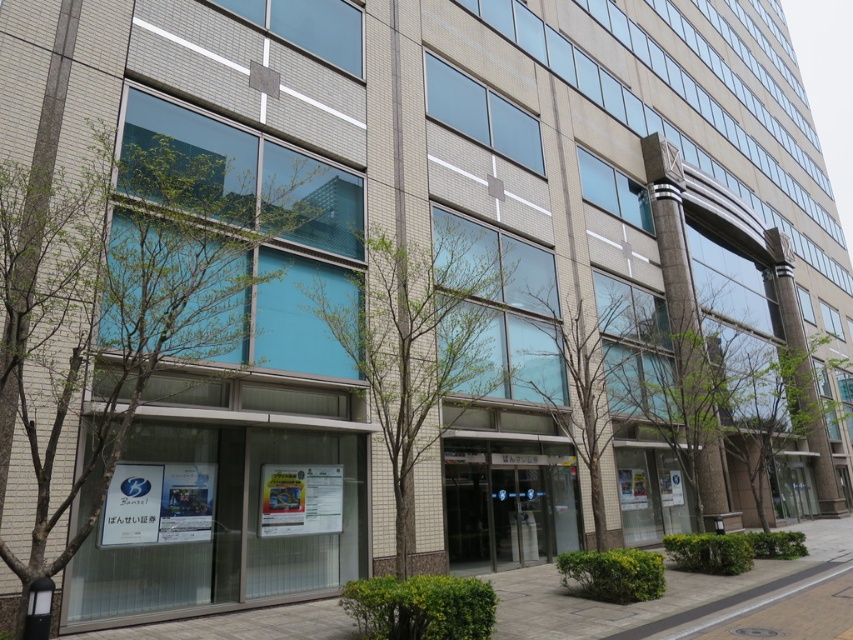
Question: Which point appears farthest from the camera in this image?

Choices:
 (A) (283, 616)
 (B) (38, 301)
 (C) (567, 308)

Answer: (C)

Question: Estimate the real-world distances between objects in this image. Which object is closer to the transparent glass window at center?

Choices:
 (A) smooth concrete pavement at lower center
 (B) bare branches at center

Answer: (A)

Question: From the image, what is the correct spatial relationship of transparent glass window at center in relation to bare branches at center?

Choices:
 (A) left
 (B) right

Answer: (A)

Question: Based on their relative distances, which object is farther from the smooth concrete pavement at lower center?

Choices:
 (A) transparent glass window at center
 (B) bare branches at center

Answer: (A)

Question: Does smooth concrete pavement at lower center appear on the left side of bare branches at center?

Choices:
 (A) yes
 (B) no

Answer: (B)

Question: From the image, what is the correct spatial relationship of smooth concrete pavement at lower center in relation to bare branches at center?

Choices:
 (A) right
 (B) left

Answer: (A)